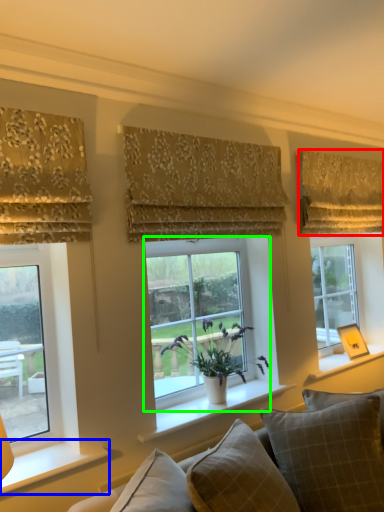
Question: Which object is the closest to the curtain (highlighted by a red box)? Choose among these: window sill (highlighted by a blue box) or window (highlighted by a green box).

Choices:
 (A) window sill
 (B) window

Answer: (B)